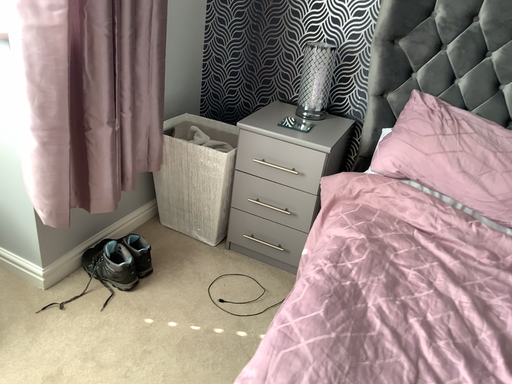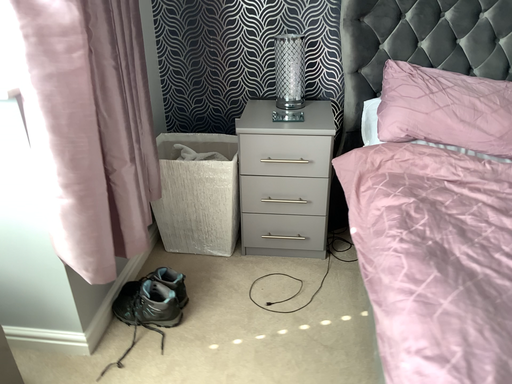
Question: How did the camera likely rotate when shooting the video?

Choices:
 (A) rotated right
 (B) rotated left

Answer: (A)